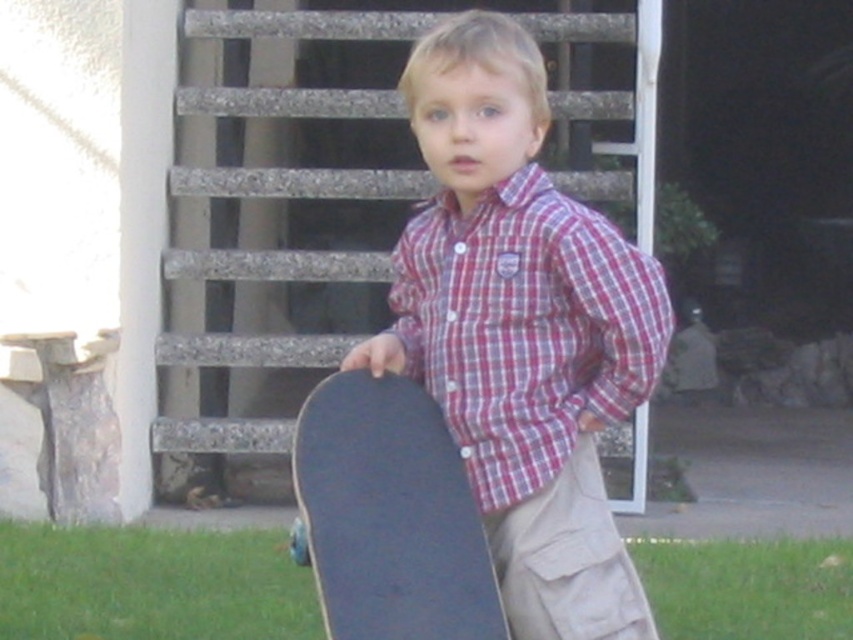
Which is more to the right, plaid cotton shirt at center or khaki cotton pants at lower center?

khaki cotton pants at lower center

Describe the element at coordinates (525, 326) in the screenshot. I see `plaid cotton shirt at center` at that location.

Where is `plaid cotton shirt at center`? This screenshot has height=640, width=853. plaid cotton shirt at center is located at coordinates (525, 326).

Who is more distant from viewer, (x=518, y=48) or (x=834, y=636)?

The point (x=834, y=636) is more distant.

Consider the image. Does matte black skateboard at center have a greater width compared to green grass at lower center?

No.

I want to click on matte black skateboard at center, so click(521, 330).

Does green grass at lower center appear over khaki cotton pants at lower center?

No.

Is point (201, 576) closer to viewer compared to point (567, 481)?

No, it is not.

Between point (160, 564) and point (584, 440), which one is positioned behind?

Point (160, 564)

The height and width of the screenshot is (640, 853). What are the coordinates of `green grass at lower center` in the screenshot? It's located at (151, 584).